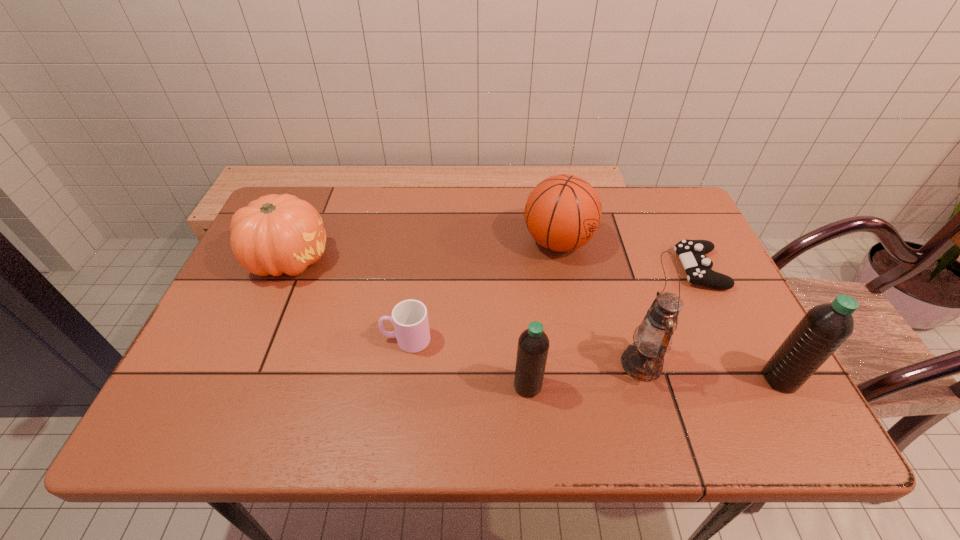
Find the location of a particular element. This screenshot has height=540, width=960. basketball situated at the far edge is located at coordinates pyautogui.click(x=563, y=212).

Find the location of a particular element. pumpkin located at the far edge is located at coordinates (275, 234).

Identify the location of oil lamp situated at the near edge. (643, 360).

In order to click on object that is positioned at the left edge in this screenshot , I will do `click(275, 234)`.

Identify the location of water bottle positioned at the right edge. The image size is (960, 540). (824, 328).

At what (x,y) coordinates should I click in order to perform the action: click on control that is at the right edge. Please return your answer as a coordinate pair (x, y). This screenshot has height=540, width=960. Looking at the image, I should click on (692, 253).

Locate an element on the screen. The height and width of the screenshot is (540, 960). object that is positioned at the far left corner is located at coordinates 275,234.

Locate an element on the screen. This screenshot has width=960, height=540. object positioned at the near right corner is located at coordinates (824, 328).

In order to click on vacant space at the far edge of the desktop in this screenshot , I will do `click(444, 196)`.

Locate an element on the screen. This screenshot has height=540, width=960. vacant area at the near edge is located at coordinates (420, 394).